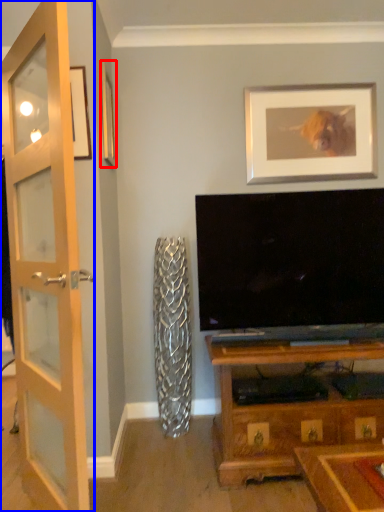
Question: Among these objects, which one is nearest to the camera, picture frame (highlighted by a red box) or door (highlighted by a blue box)?

Choices:
 (A) picture frame
 (B) door

Answer: (B)